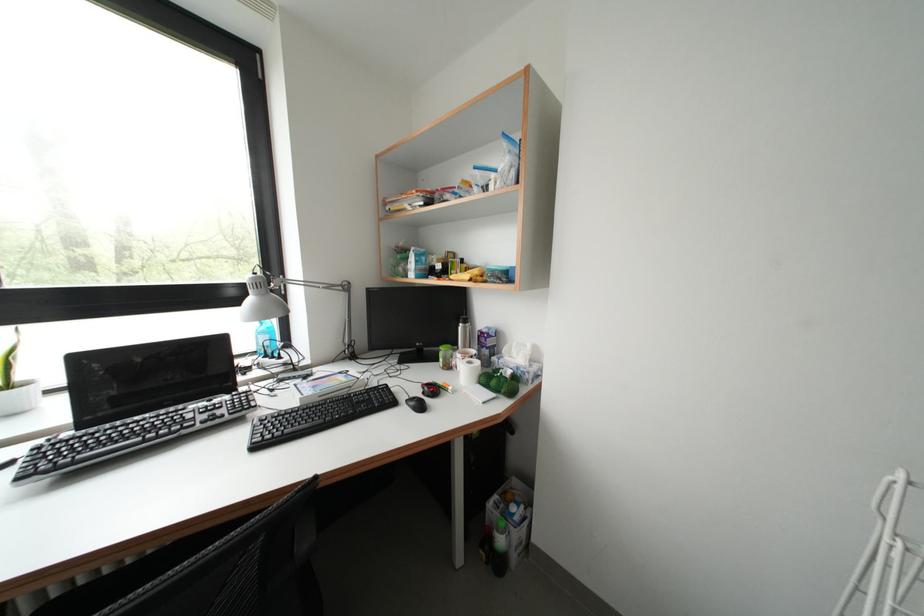
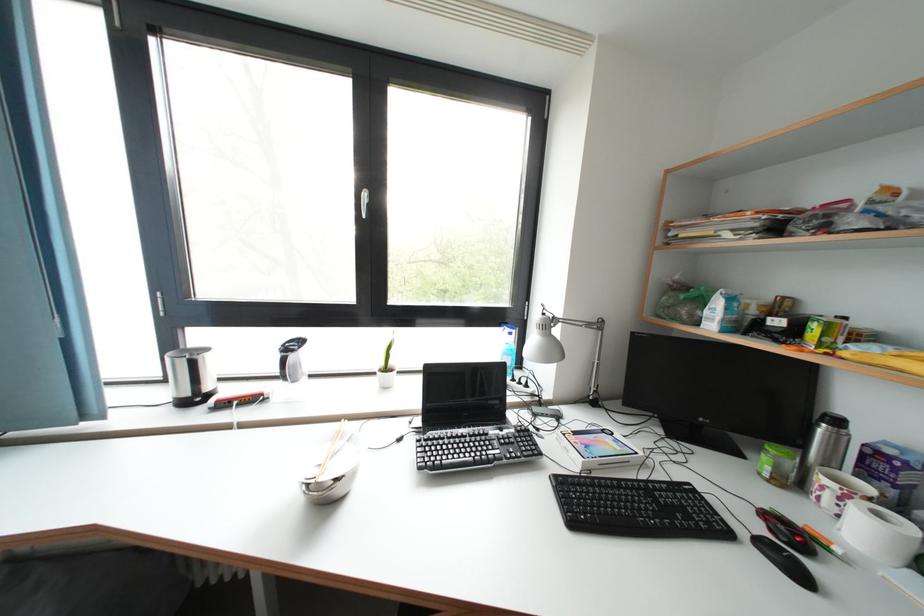
Question: How did the camera likely rotate?

Choices:
 (A) Left
 (B) Right
 (C) Up
 (D) Down

Answer: (A)